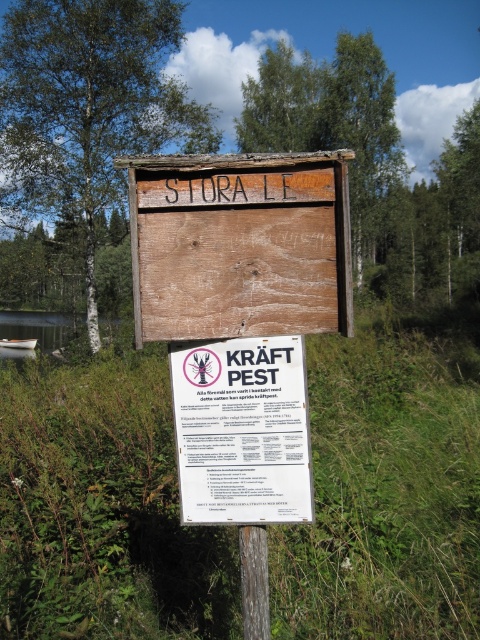
Does green leafy tree at upper left appear under brushed metal water at lower left?

Incorrect, green leafy tree at upper left is not positioned below brushed metal water at lower left.

Does green leafy tree at upper left have a larger size compared to brushed metal water at lower left?

Incorrect, green leafy tree at upper left is not larger than brushed metal water at lower left.

This screenshot has width=480, height=640. What do you see at coordinates (87, 108) in the screenshot? I see `green leafy tree at upper left` at bounding box center [87, 108].

Locate an element on the screen. The width and height of the screenshot is (480, 640). green leafy tree at upper left is located at coordinates (87, 108).

Is brown wood tree at upper center taller than wooden post at center?

Indeed, brown wood tree at upper center has a greater height compared to wooden post at center.

Identify the location of brown wood tree at upper center. (332, 124).

Is brushed metal water at lower left further to the viewer compared to white plastic canoe at left?

No, it is in front of white plastic canoe at left.

Is brushed metal water at lower left thinner than white plastic canoe at left?

In fact, brushed metal water at lower left might be wider than white plastic canoe at left.

This screenshot has height=640, width=480. Identify the location of brushed metal water at lower left. (38, 326).

The height and width of the screenshot is (640, 480). I want to click on brushed metal water at lower left, so click(x=38, y=326).